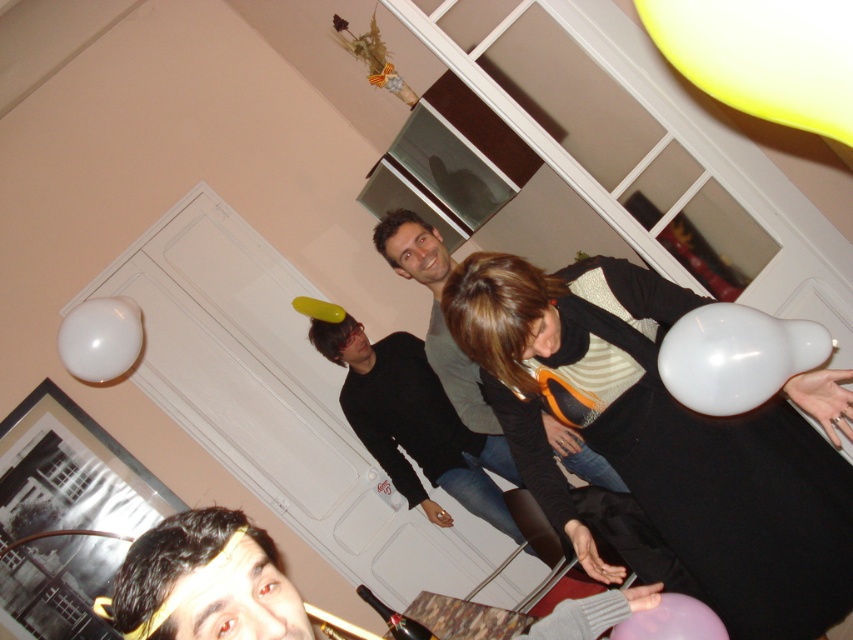
From the picture: Is shiny gold headband at lower left below purple matte balloon at lower right?

Actually, shiny gold headband at lower left is above purple matte balloon at lower right.

Between shiny gold headband at lower left and purple matte balloon at lower right, which one appears on the left side from the viewer's perspective?

shiny gold headband at lower left

Is point (239, 600) positioned behind point (679, 632)?

No, (239, 600) is in front of (679, 632).

This screenshot has width=853, height=640. I want to click on shiny gold headband at lower left, so click(x=206, y=582).

Does yellow matte balloon at upper right have a larger size compared to black matte shirt at center?

No, yellow matte balloon at upper right is not bigger than black matte shirt at center.

Who is taller, yellow matte balloon at upper right or black matte shirt at center?

Standing taller between the two is black matte shirt at center.

Describe the element at coordinates (763, 56) in the screenshot. I see `yellow matte balloon at upper right` at that location.

Image resolution: width=853 pixels, height=640 pixels. I want to click on yellow matte balloon at upper right, so click(763, 56).

Locate an element on the screen. The height and width of the screenshot is (640, 853). white glossy balloon at right is located at coordinates (735, 356).

Which is behind, point (720, 324) or point (643, 632)?

Positioned behind is point (720, 324).

Measure the distance between white glossy balloon at right and camera.

white glossy balloon at right is 1.37 meters away from camera.

Image resolution: width=853 pixels, height=640 pixels. Find the location of `white glossy balloon at right`. white glossy balloon at right is located at coordinates (735, 356).